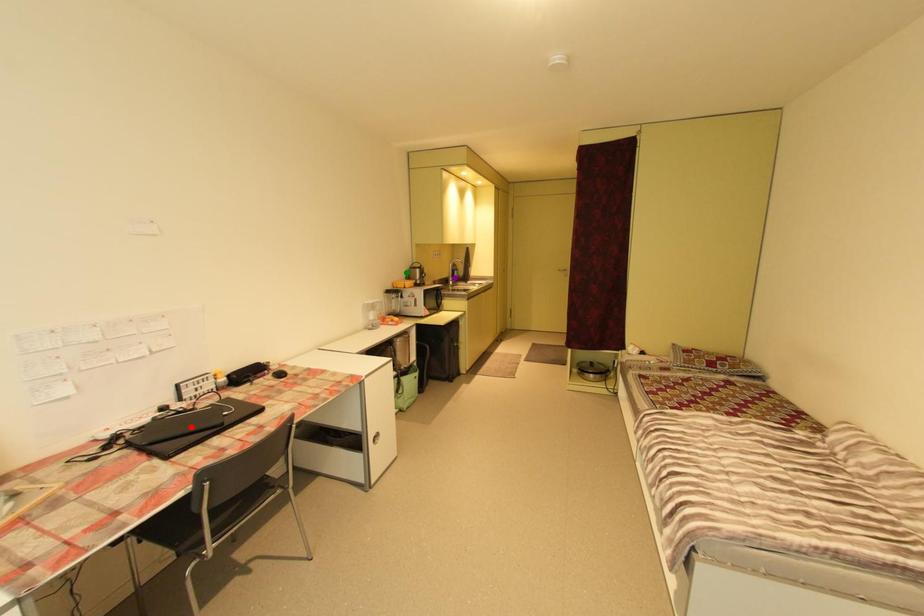
Order these from nearest to farthest:
green point, purple point, red point

purple point
green point
red point